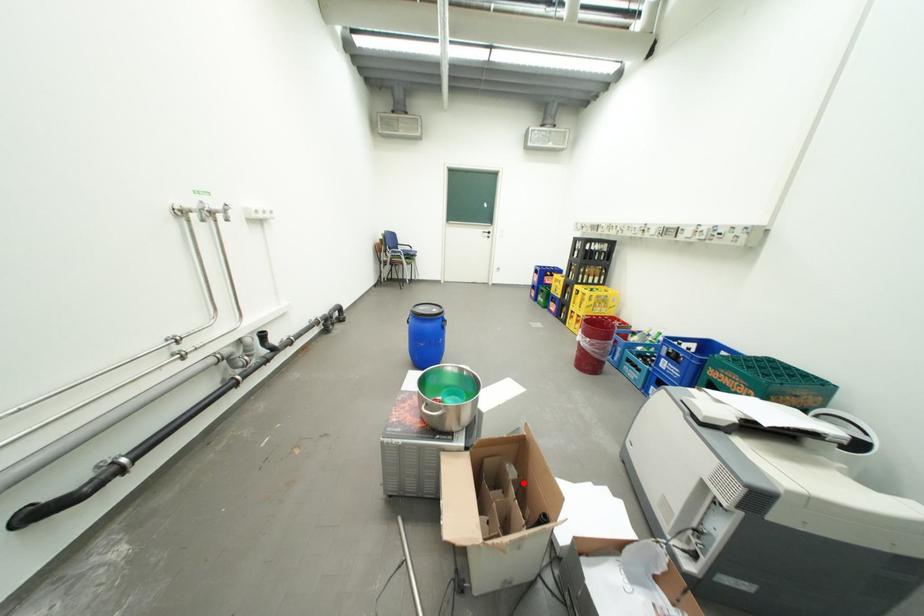
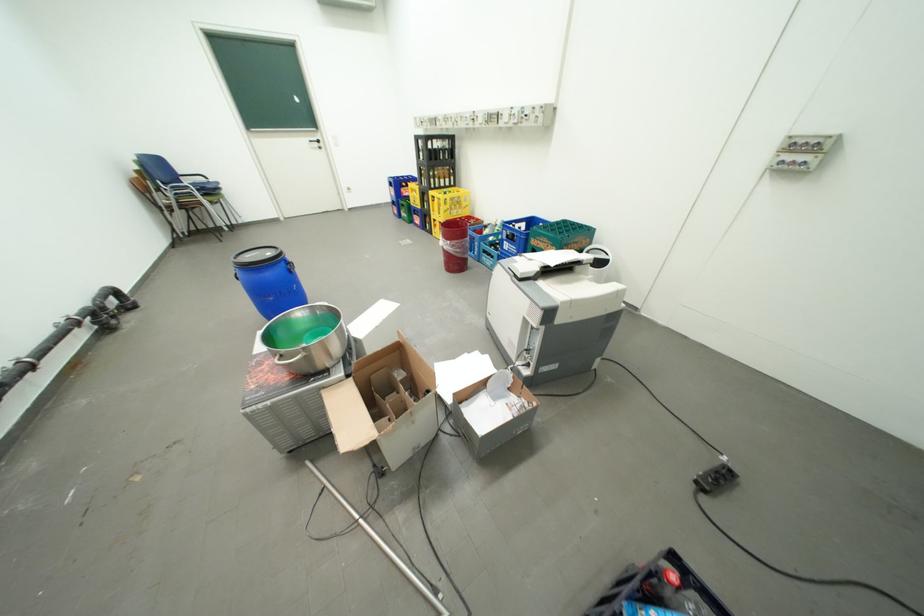
In the second image, find the point that corresponds to the highlighted location in the first image.

(410, 382)